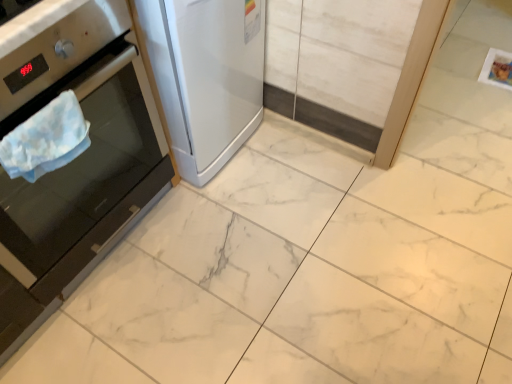
Question: From a real-world perspective, does satin white refrigerator at left, the 2th home appliance when ordered from left to right, stand above stainless steel oven at left, marked as the 1th home appliance in a left-to-right arrangement?

Choices:
 (A) yes
 (B) no

Answer: (B)

Question: Does satin white refrigerator at left, arranged as the 1th home appliance when viewed from the right, turn towards stainless steel oven at left, marked as the 1th home appliance in a left-to-right arrangement?

Choices:
 (A) yes
 (B) no

Answer: (B)

Question: From the image's perspective, does satin white refrigerator at left, arranged as the 1th home appliance when viewed from the right, appear higher than stainless steel oven at left, the second home appliance viewed from the right?

Choices:
 (A) no
 (B) yes

Answer: (B)

Question: Considering the relative sizes of satin white refrigerator at left, the 2th home appliance when ordered from left to right, and stainless steel oven at left, marked as the 1th home appliance in a left-to-right arrangement, in the image provided, is satin white refrigerator at left, the 2th home appliance when ordered from left to right, bigger than stainless steel oven at left, marked as the 1th home appliance in a left-to-right arrangement,?

Choices:
 (A) no
 (B) yes

Answer: (A)

Question: Does satin white refrigerator at left, the 2th home appliance when ordered from left to right, have a smaller size compared to stainless steel oven at left, marked as the 1th home appliance in a left-to-right arrangement?

Choices:
 (A) no
 (B) yes

Answer: (B)

Question: Based on their sizes in the image, would you say blue fabric towel at left is bigger or smaller than stainless steel oven at left, the second home appliance viewed from the right?

Choices:
 (A) big
 (B) small

Answer: (B)

Question: From the image's perspective, is blue fabric towel at left above or below stainless steel oven at left, marked as the 1th home appliance in a left-to-right arrangement?

Choices:
 (A) above
 (B) below

Answer: (B)

Question: Is blue fabric towel at left to the left or to the right of stainless steel oven at left, marked as the 1th home appliance in a left-to-right arrangement, in the image?

Choices:
 (A) right
 (B) left

Answer: (A)

Question: In the image, is blue fabric towel at left positioned in front of or behind stainless steel oven at left, marked as the 1th home appliance in a left-to-right arrangement?

Choices:
 (A) behind
 (B) front

Answer: (A)

Question: In the image, is stainless steel oven at left, the second home appliance viewed from the right, on the left side or the right side of satin white refrigerator at left, the 2th home appliance when ordered from left to right?

Choices:
 (A) right
 (B) left

Answer: (B)

Question: Looking at their shapes, would you say stainless steel oven at left, the second home appliance viewed from the right, is wider or thinner than satin white refrigerator at left, the 2th home appliance when ordered from left to right?

Choices:
 (A) wide
 (B) thin

Answer: (A)

Question: Considering their positions, is stainless steel oven at left, marked as the 1th home appliance in a left-to-right arrangement, located in front of or behind satin white refrigerator at left, arranged as the 1th home appliance when viewed from the right?

Choices:
 (A) behind
 (B) front

Answer: (B)

Question: Choose the correct answer: Is stainless steel oven at left, the second home appliance viewed from the right, inside satin white refrigerator at left, the 2th home appliance when ordered from left to right, or outside it?

Choices:
 (A) inside
 (B) outside

Answer: (B)

Question: From a real-world perspective, is satin white refrigerator at left, the 2th home appliance when ordered from left to right, physically located above or below blue fabric towel at left?

Choices:
 (A) above
 (B) below

Answer: (B)

Question: Is satin white refrigerator at left, the 2th home appliance when ordered from left to right, bigger or smaller than blue fabric towel at left?

Choices:
 (A) big
 (B) small

Answer: (A)